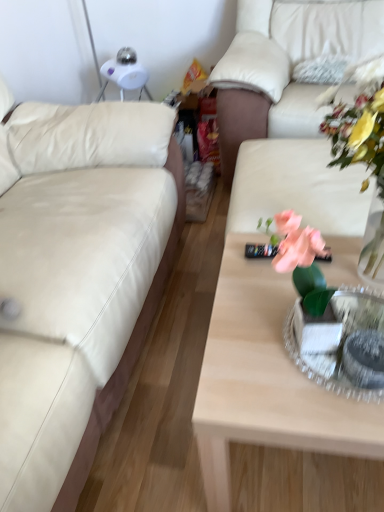
Where is `empty space that is ontop of light wood coffee table at center (from a real-world perspective)`? empty space that is ontop of light wood coffee table at center (from a real-world perspective) is located at coordinates (292, 289).